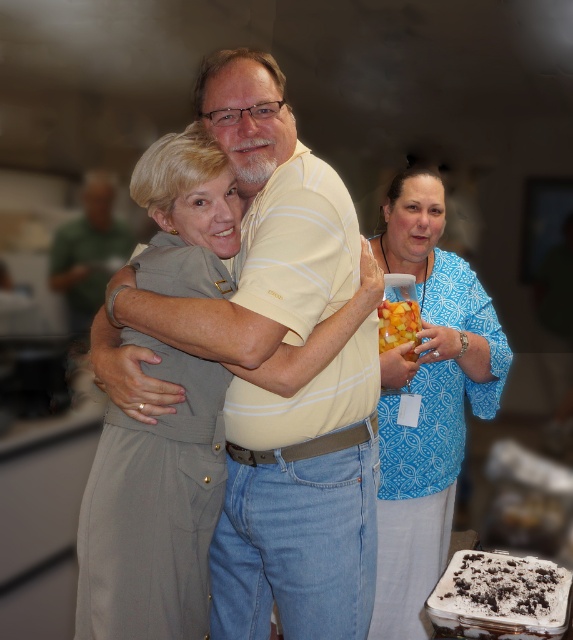
Can you confirm if white chocolate cake at lower right is thinner than translucent plastic cup at center?

No, white chocolate cake at lower right is not thinner than translucent plastic cup at center.

At what (x,y) coordinates should I click in order to perform the action: click on white chocolate cake at lower right. Please return your answer as a coordinate pair (x, y). Looking at the image, I should click on [x=500, y=596].

Which is behind, point (270, 403) or point (391, 324)?

The point (391, 324) is behind.

Does yellow striped shirt at center have a greater width compared to translucent plastic cup at center?

Yes.

Is point (274, 205) behind point (391, 333)?

No, (274, 205) is in front of (391, 333).

You are a GUI agent. You are given a task and a screenshot of the screen. Output one action in this format:
    pyautogui.click(x=<x>, y=<y>)
    Task: Click on the yellow striped shirt at center
    The width and height of the screenshot is (573, 640).
    Given the screenshot: What is the action you would take?
    pyautogui.click(x=264, y=364)

Does blue patterned blouse at center have a lesser width compared to green fabric shirt at upper left?

Yes.

The image size is (573, 640). In order to click on blue patterned blouse at center in this screenshot , I will do `click(427, 401)`.

The width and height of the screenshot is (573, 640). I want to click on blue patterned blouse at center, so click(x=427, y=401).